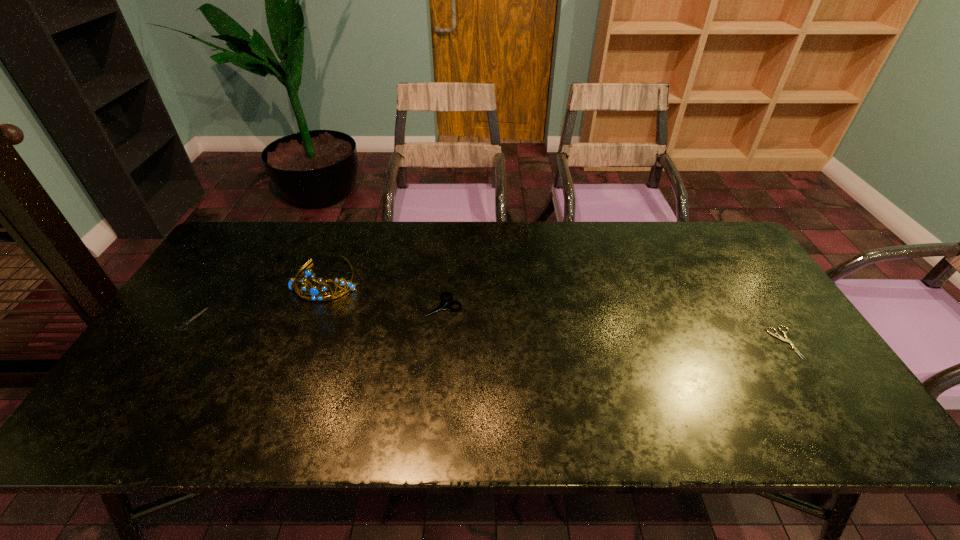
Where is `the second object from left to right`? the second object from left to right is located at coordinates (316, 293).

Locate an element on the screen. the tallest object is located at coordinates (316, 293).

Identify the location of the second tallest object. (442, 305).

At what (x,y) coordinates should I click in order to perform the action: click on the third object from left to right. Please return your answer as a coordinate pair (x, y). The height and width of the screenshot is (540, 960). Looking at the image, I should click on (442, 305).

You are a GUI agent. You are given a task and a screenshot of the screen. Output one action in this format:
    pyautogui.click(x=<x>, y=<y>)
    Task: Click on the leftmost shears
    The height and width of the screenshot is (540, 960).
    Given the screenshot: What is the action you would take?
    pyautogui.click(x=186, y=323)

Identify the location of the rightmost object. This screenshot has width=960, height=540. (778, 336).

Locate an element on the screen. This screenshot has height=540, width=960. vacant space situated 0.400m on the front-facing side of the tallest object is located at coordinates (267, 434).

Identify the location of free location located on the left of the third object from left to right. (300, 306).

Image resolution: width=960 pixels, height=540 pixels. In order to click on free space located on the right of the leftmost shears in this screenshot , I will do [270, 319].

Find the location of a particular element. blank space located 0.350m on the back of the rightmost shears is located at coordinates (722, 246).